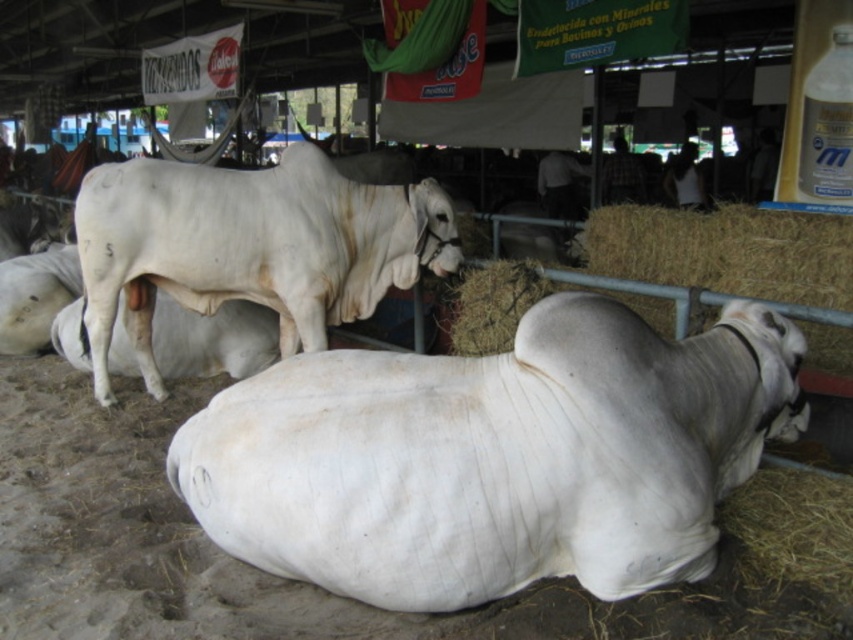
Does white smooth cow at lower center have a larger size compared to white smooth bull at upper center?

Incorrect, white smooth cow at lower center is not larger than white smooth bull at upper center.

Between point (403, 576) and point (126, 244), which one is positioned in front?

Positioned in front is point (403, 576).

This screenshot has width=853, height=640. Find the location of `white smooth cow at lower center`. white smooth cow at lower center is located at coordinates (494, 456).